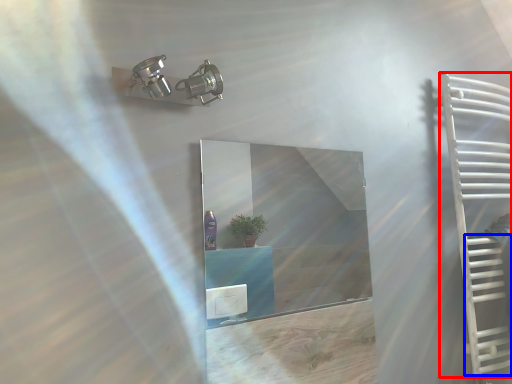
Question: Which point is further to the camera, ladder (highlighted by a red box) or stairs (highlighted by a blue box)?

Choices:
 (A) ladder
 (B) stairs

Answer: (B)